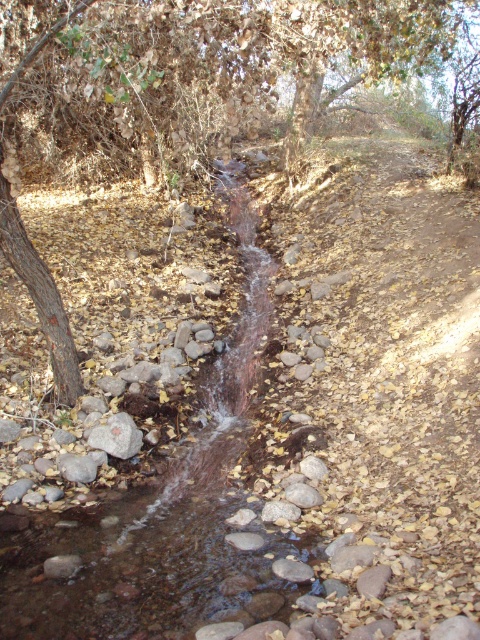
You are standing at the edge of the stream and want to place a small pebble at point A and a larger rock at point B. Given that point A is point (63, 317) and point B is point (112, 456), which point is closer to you?

Point A is closer to you because it is further to the camera than point B.

In the scene shown: You are planning to cross the clear water stream at center and need to know if the brown textured tree at upper left can provide shade over the stream. Based on the scene description, can the tree provide shade over the stream?

The clear water stream at center occupies less space than brown textured tree at upper left, which means the tree is larger. Since the tree is at the upper left and the stream is at the center, it is possible that the tree could cast shade over the stream depending on the time of day and sun angle, but the description does not specify this. However, based on the given information, the brown textured tree at upper left is larger in size and positioned above the stream, so it might provide some shade over the